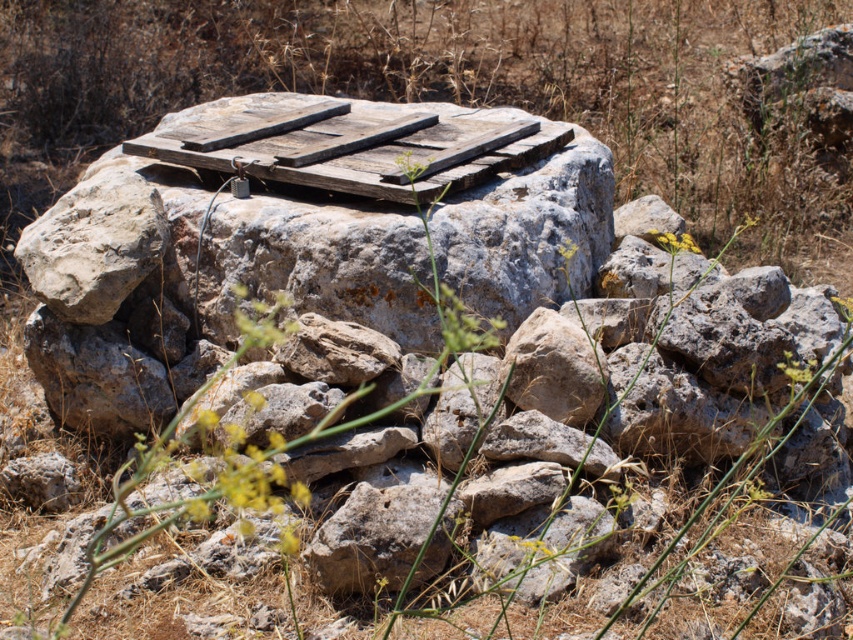
Question: Which point is farther to the camera?

Choices:
 (A) (399, 296)
 (B) (375, 179)

Answer: (B)

Question: Which of the following is the farthest from the observer?

Choices:
 (A) weathered wood at center
 (B) weathered wood pallet at center

Answer: (B)

Question: Is weathered wood at center further to camera compared to weathered wood pallet at center?

Choices:
 (A) no
 (B) yes

Answer: (A)

Question: From the image, what is the correct spatial relationship of weathered wood at center in relation to weathered wood pallet at center?

Choices:
 (A) above
 (B) below

Answer: (B)

Question: Which object is closer to the camera taking this photo?

Choices:
 (A) weathered wood at center
 (B) weathered wood pallet at center

Answer: (A)

Question: Does weathered wood at center have a smaller size compared to weathered wood pallet at center?

Choices:
 (A) no
 (B) yes

Answer: (A)